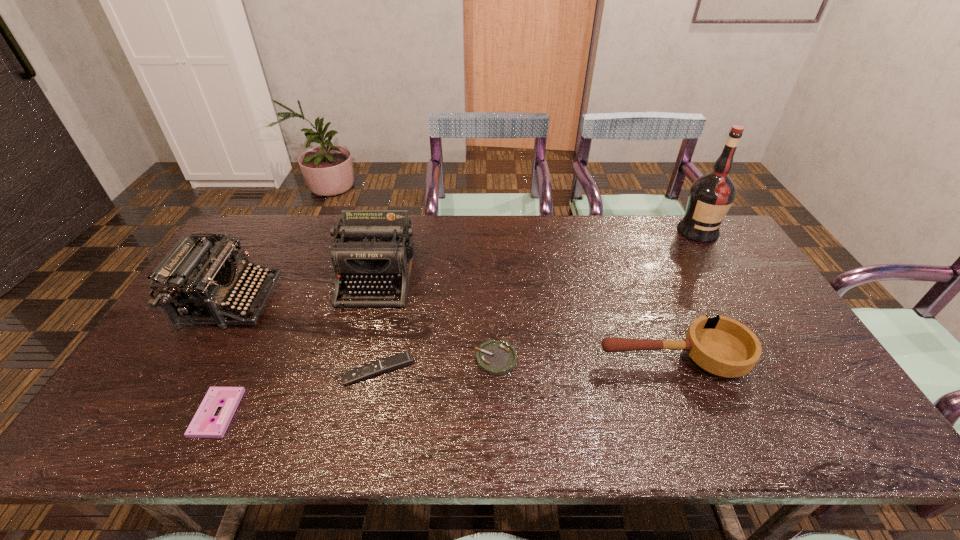
The image size is (960, 540). Find the location of `free space located 0.150m on the surface of the rightmost object`. free space located 0.150m on the surface of the rightmost object is located at coordinates (723, 272).

At what (x,y) coordinates should I click in order to perform the action: click on free space located 0.130m on the keyboard of the right typewriter. Please return your answer as a coordinate pair (x, y). Looking at the image, I should click on (359, 346).

Where is `free region located on the typing side of the left typewriter`? The image size is (960, 540). free region located on the typing side of the left typewriter is located at coordinates (387, 301).

Locate an element on the screen. Image resolution: width=960 pixels, height=540 pixels. free region located with the handle on the side of the sixth object from left to right is located at coordinates pos(544,359).

The height and width of the screenshot is (540, 960). What are the coordinates of `free space located with the handle on the side of the sixth object from left to right` in the screenshot? It's located at (498, 359).

Locate an element on the screen. Image resolution: width=960 pixels, height=540 pixels. vacant position located with the handle on the side of the sixth object from left to right is located at coordinates (464, 359).

In order to click on vacant area located 0.160m on the front of the third object from right to left in this screenshot , I will do `click(498, 436)`.

I want to click on blank area located 0.140m on the right of the remote control, so click(468, 370).

Find the location of a particular element. The width and height of the screenshot is (960, 540). free space located on the back of the shortest object is located at coordinates (247, 354).

Find the location of a particular element. Image resolution: width=960 pixels, height=540 pixels. liquor located at the far edge is located at coordinates (711, 195).